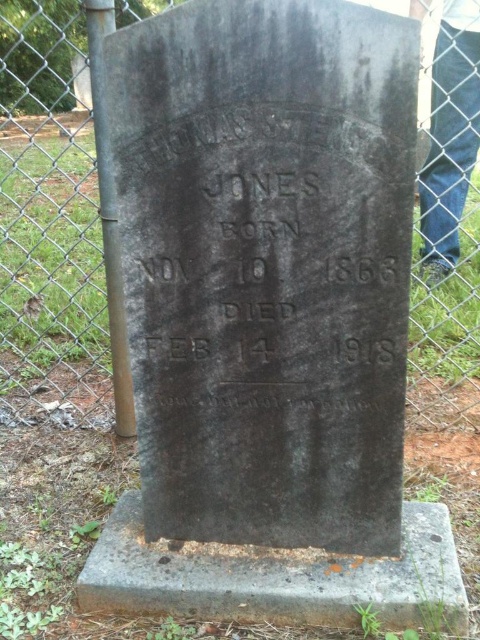
Question: Is metal chain-link fence at upper left to the left of dark gray stone gravestone at center from the viewer's perspective?

Choices:
 (A) yes
 (B) no

Answer: (A)

Question: Is metal chain-link fence at upper left below dark gray stone gravestone at center?

Choices:
 (A) yes
 (B) no

Answer: (B)

Question: Among these objects, which one is nearest to the camera?

Choices:
 (A) dark gray stone gravestone at center
 (B) metal chain-link fence at upper left

Answer: (A)

Question: Does metal chain-link fence at upper left have a smaller size compared to dark gray stone gravestone at center?

Choices:
 (A) no
 (B) yes

Answer: (A)